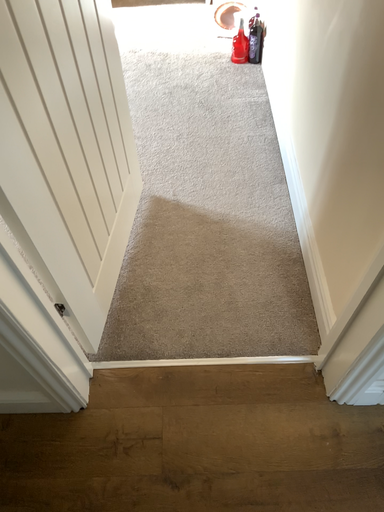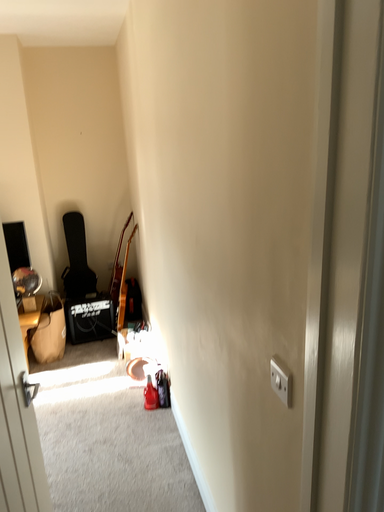
Question: How did the camera likely rotate when shooting the video?

Choices:
 (A) rotated upward
 (B) rotated downward

Answer: (A)